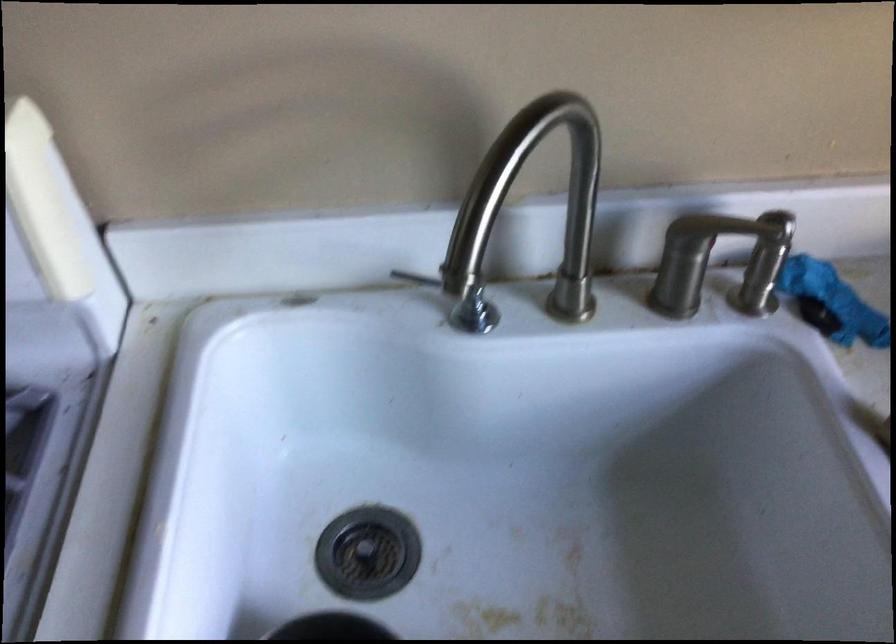
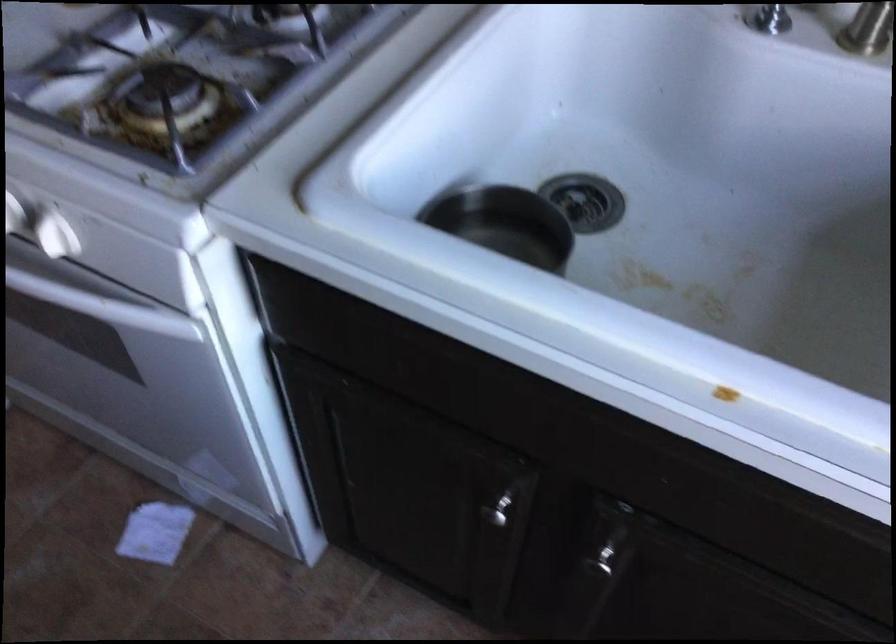
Question: The camera is either moving clockwise (left) or counter-clockwise (right) around the object. The first image is from the beginning of the video and the second image is from the end. Is the camera moving left or right when shooting the video?

Choices:
 (A) Left
 (B) Right

Answer: (B)